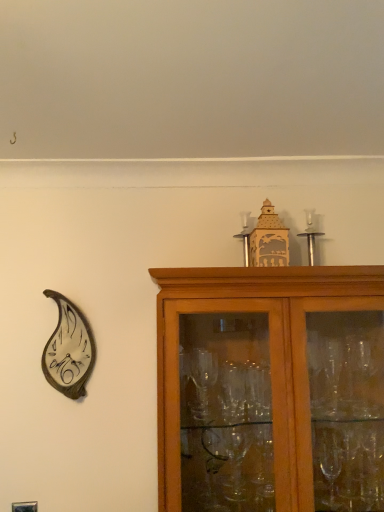
Question: Can you confirm if silver metallic candle holder at upper center, the 2th candle holder when ordered from right to left, is positioned to the left of silver metallic candle holder at upper center, which is the second candle holder from left to right?

Choices:
 (A) yes
 (B) no

Answer: (A)

Question: Is silver metallic candle holder at upper center, the 2th candle holder when ordered from right to left, wider than silver metallic candle holder at upper center, which is the second candle holder from left to right?

Choices:
 (A) yes
 (B) no

Answer: (B)

Question: Is silver metallic candle holder at upper center, acting as the 1th candle holder starting from the left, at the right side of silver metallic candle holder at upper center, the first candle holder in the right-to-left sequence?

Choices:
 (A) yes
 (B) no

Answer: (B)

Question: Would you consider silver metallic candle holder at upper center, acting as the 1th candle holder starting from the left, to be distant from silver metallic candle holder at upper center, the first candle holder in the right-to-left sequence?

Choices:
 (A) no
 (B) yes

Answer: (A)

Question: Is silver metallic candle holder at upper center, the 2th candle holder when ordered from right to left, with silver metallic candle holder at upper center, which is the second candle holder from left to right?

Choices:
 (A) yes
 (B) no

Answer: (B)

Question: Relative to brown wooden cabinet at upper right, is silver metallic candle holder at upper center, which is the second candle holder from left to right, in front or behind?

Choices:
 (A) behind
 (B) front

Answer: (A)

Question: From a real-world perspective, is silver metallic candle holder at upper center, which is the second candle holder from left to right, positioned above or below brown wooden cabinet at upper right?

Choices:
 (A) above
 (B) below

Answer: (A)

Question: In terms of width, does silver metallic candle holder at upper center, which is the second candle holder from left to right, look wider or thinner when compared to brown wooden cabinet at upper right?

Choices:
 (A) wide
 (B) thin

Answer: (B)

Question: Considering the positions of silver metallic candle holder at upper center, the first candle holder in the right-to-left sequence, and brown wooden cabinet at upper right in the image, is silver metallic candle holder at upper center, the first candle holder in the right-to-left sequence, bigger or smaller than brown wooden cabinet at upper right?

Choices:
 (A) small
 (B) big

Answer: (A)

Question: Considering the positions of metallic leaf-shaped clock at left and silver metallic candle holder at upper center, the 2th candle holder when ordered from right to left, in the image, is metallic leaf-shaped clock at left bigger or smaller than silver metallic candle holder at upper center, the 2th candle holder when ordered from right to left,?

Choices:
 (A) small
 (B) big

Answer: (B)

Question: From the image's perspective, relative to silver metallic candle holder at upper center, the 2th candle holder when ordered from right to left, is metallic leaf-shaped clock at left above or below?

Choices:
 (A) below
 (B) above

Answer: (A)

Question: From a real-world perspective, relative to silver metallic candle holder at upper center, acting as the 1th candle holder starting from the left, is metallic leaf-shaped clock at left vertically above or below?

Choices:
 (A) below
 (B) above

Answer: (A)

Question: Is metallic leaf-shaped clock at left inside the boundaries of silver metallic candle holder at upper center, the 2th candle holder when ordered from right to left, or outside?

Choices:
 (A) inside
 (B) outside

Answer: (B)

Question: From a real-world perspective, is silver metallic candle holder at upper center, which is the second candle holder from left to right, above or below metallic leaf-shaped clock at left?

Choices:
 (A) below
 (B) above

Answer: (B)

Question: Considering their positions, is silver metallic candle holder at upper center, the first candle holder in the right-to-left sequence, located in front of or behind metallic leaf-shaped clock at left?

Choices:
 (A) behind
 (B) front

Answer: (A)